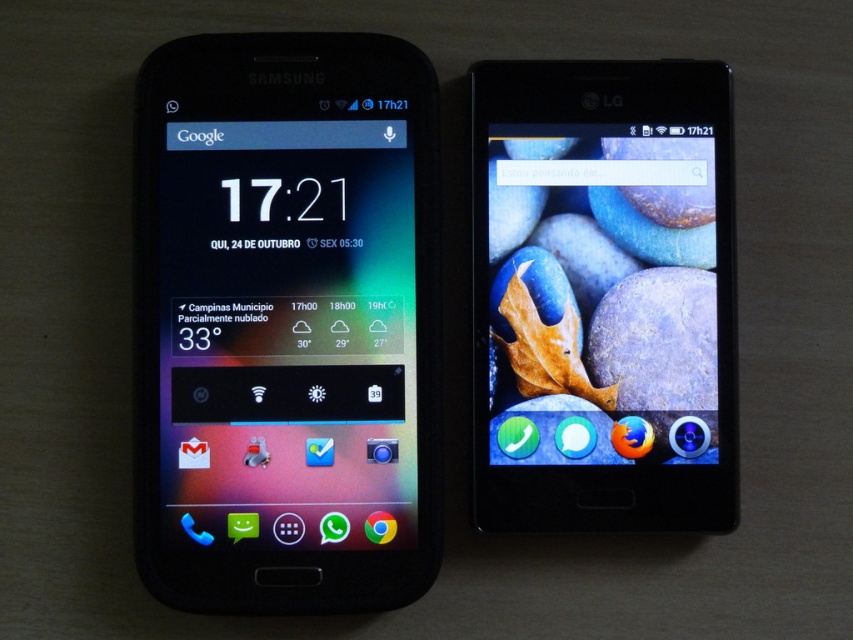
You are setting up a display for a tech store and need to arrange two matte black phones. According to the image, where should you place the matte black phone at left relative to the matte black phone at right?

The matte black phone at left should be placed below the matte black phone at right as per the image.

You are a delivery robot with a 6 inch wide package. You need to place the package between the matte black phone at left and the matte black phone at right. Can you fit the package between them without moving the phones?

The distance between the matte black phone at left and the matte black phone at right is 6.19 inches, so yes, the 6 inch wide package can fit between them since the space is slightly larger than the package.